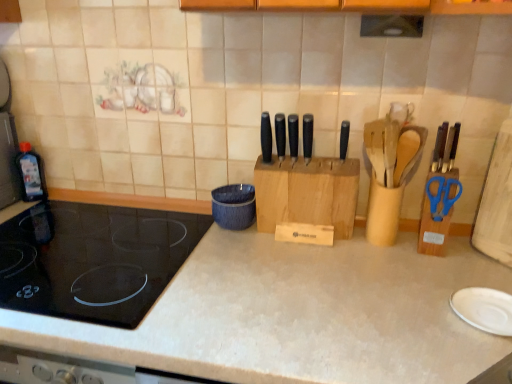
You are a GUI agent. You are given a task and a screenshot of the screen. Output one action in this format:
    pyautogui.click(x=<x>, y=<y>)
    Task: Click on the vacant space in between transparent plastic bottle at left and wooden knife block at center
    This screenshot has width=512, height=384.
    Given the screenshot: What is the action you would take?
    pyautogui.click(x=138, y=211)